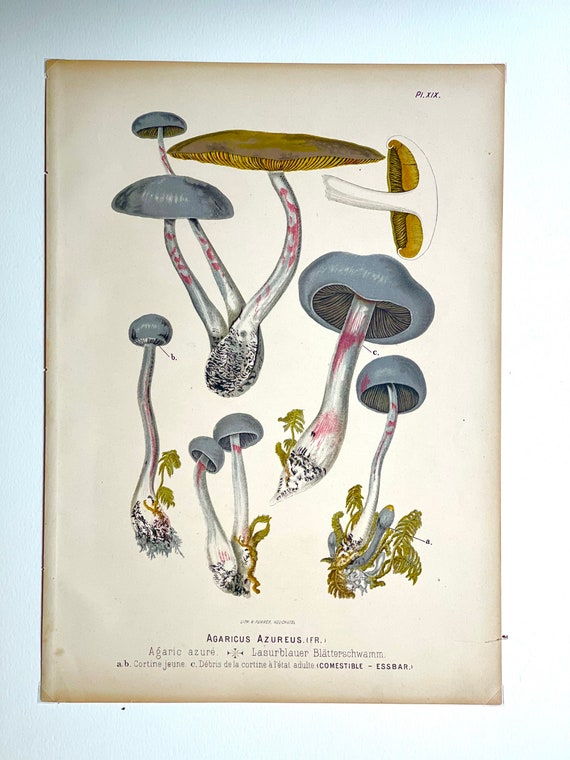
I want to click on 1 poster on background, so click(x=105, y=606).